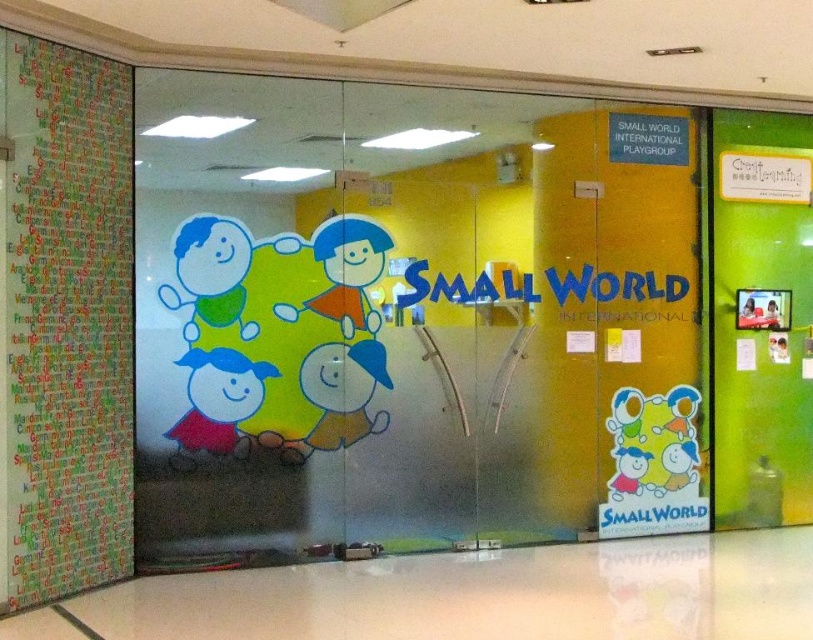
Between multicolored paper at left and green matte door at right, which one is positioned lower?

Positioned lower is green matte door at right.

Where is `multicolored paper at left`? multicolored paper at left is located at coordinates (66, 317).

How much distance is there between transparent glass door at center and matte red dress at lower left?

transparent glass door at center and matte red dress at lower left are 37.77 inches apart.

Does point (572, 396) come in front of point (200, 353)?

No, it is not.

What are the coordinates of `transparent glass door at center` in the screenshot? It's located at (415, 317).

Who is shorter, transparent glass door at center or green matte door at right?

transparent glass door at center is shorter.

Does transparent glass door at center have a smaller size compared to green matte door at right?

No, transparent glass door at center is not smaller than green matte door at right.

Describe the element at coordinates (415, 317) in the screenshot. I see `transparent glass door at center` at that location.

I want to click on transparent glass door at center, so click(x=415, y=317).